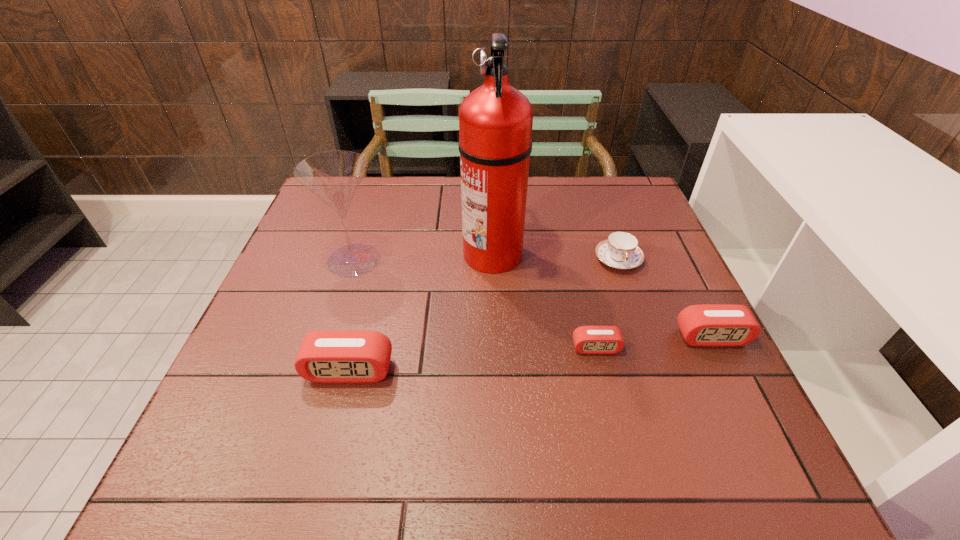
Identify the location of empty space that is in between the fire extinguisher and the flute glass. This screenshot has height=540, width=960. (423, 256).

This screenshot has width=960, height=540. I want to click on vacant area between the flute glass and the rightmost object, so click(x=533, y=298).

I want to click on vacant area between the rightmost alarm clock and the fifth shortest object, so click(533, 298).

At what (x,y) coordinates should I click in order to perform the action: click on free space between the fifth shortest object and the nearest alarm clock. Please return your answer as a coordinate pair (x, y). The height and width of the screenshot is (540, 960). Looking at the image, I should click on (351, 315).

Locate an element on the screen. free space between the nearest alarm clock and the fire extinguisher is located at coordinates (420, 312).

This screenshot has height=540, width=960. Identify the location of empty location between the fourth tallest object and the flute glass. (533, 298).

This screenshot has width=960, height=540. Find the location of `free point between the second tallest alarm clock and the fourth object from right to left`. free point between the second tallest alarm clock and the fourth object from right to left is located at coordinates (602, 295).

This screenshot has width=960, height=540. I want to click on vacant region between the flute glass and the shortest object, so click(x=475, y=303).

Find the location of a particular element. This screenshot has height=540, width=960. the second closest object to the teacup is located at coordinates (495, 120).

The image size is (960, 540). In order to click on object that is the third closest to the nearest alarm clock in this screenshot , I will do `click(587, 339)`.